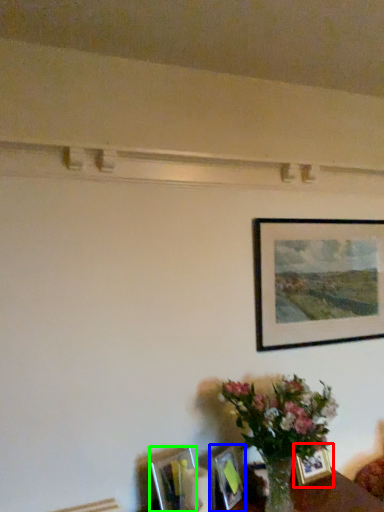
Question: Considering the real-world distances, which object is closest to picture frame (highlighted by a red box)? picture frame (highlighted by a blue box) or picture frame (highlighted by a green box).

Choices:
 (A) picture frame
 (B) picture frame

Answer: (A)